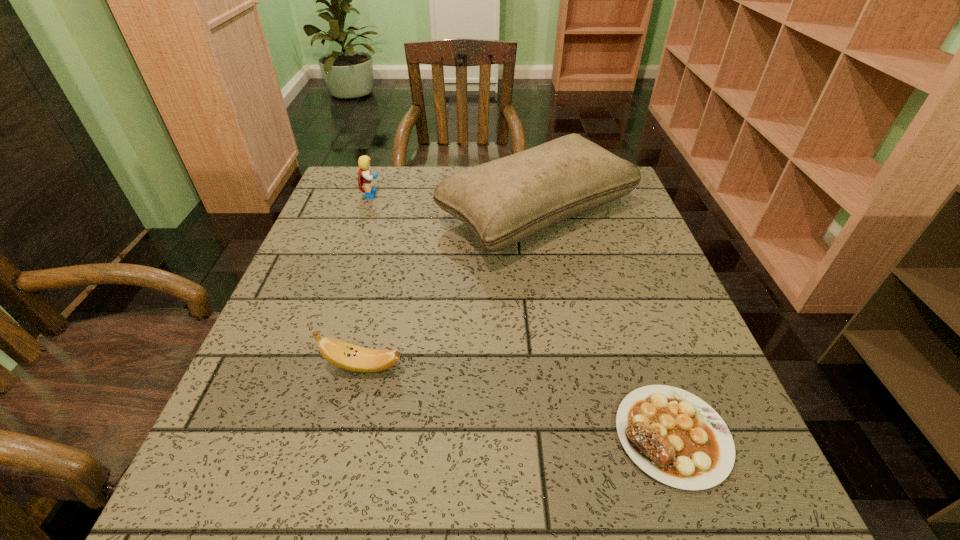
Find the location of a particular element. vacant space that satisfies the following two spatial constraints: 1. on the front-facing side of the shortest object; 2. on the left side of the Lego is located at coordinates (291, 436).

I want to click on free space that satisfies the following two spatial constraints: 1. on the front side of the steak; 2. on the left side of the second shortest object, so click(347, 436).

You are a GUI agent. You are given a task and a screenshot of the screen. Output one action in this format:
    pyautogui.click(x=<x>, y=<y>)
    Task: Click on the vacant space that satisfies the following two spatial constraints: 1. on the back side of the third farthest object; 2. on the left side of the tallest object
    The width and height of the screenshot is (960, 540).
    Given the screenshot: What is the action you would take?
    pyautogui.click(x=400, y=212)

At what (x,y) coordinates should I click in order to perform the action: click on free space that satisfies the following two spatial constraints: 1. on the front-facing side of the third shortest object; 2. on the left side of the cushion. Please return your answer as a coordinate pair (x, y). The width and height of the screenshot is (960, 540). Looking at the image, I should click on (367, 212).

This screenshot has height=540, width=960. Find the location of `free spot that satisfies the following two spatial constraints: 1. on the front-facing side of the second tallest object; 2. on the right side of the tallest object`. free spot that satisfies the following two spatial constraints: 1. on the front-facing side of the second tallest object; 2. on the right side of the tallest object is located at coordinates (367, 212).